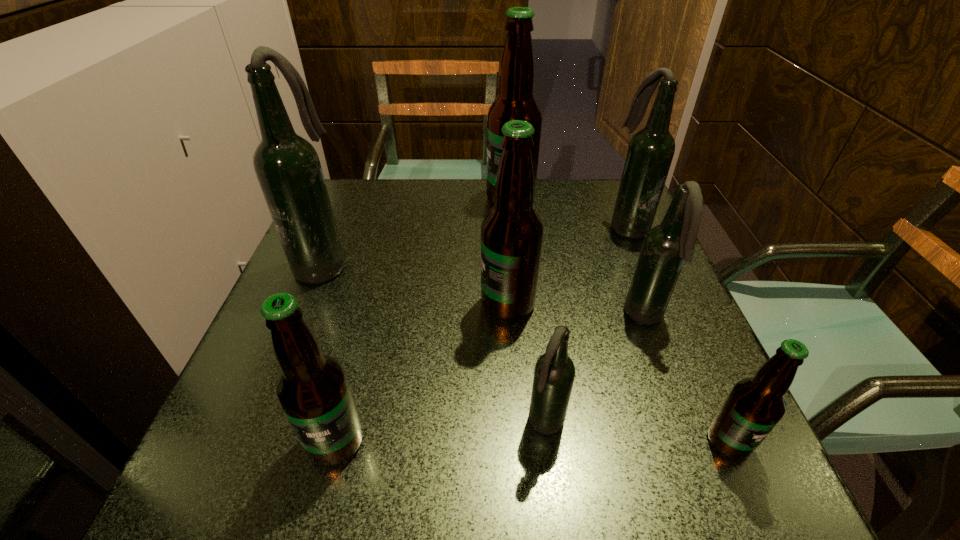
Locate an element on the screen. free spot that satisfies the following two spatial constraints: 1. on the front side of the third biggest dark beer bottle; 2. on the left side of the biggest dark beer bottle is located at coordinates (300, 318).